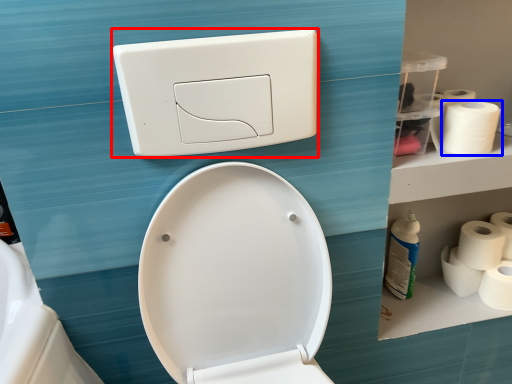
Question: Which object is closer to the camera taking this photo, light switch (highlighted by a red box) or toilet paper (highlighted by a blue box)?

Choices:
 (A) light switch
 (B) toilet paper

Answer: (A)